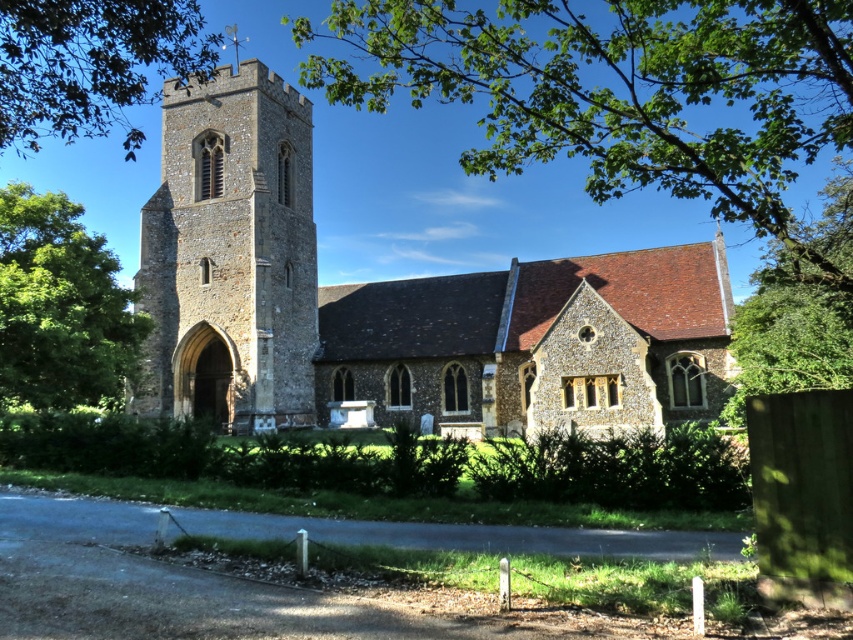
You are standing on the paved road in front of the stone church at center and want to walk towards the green leafy tree at left. Which direction should you face to approach the tree?

You should face towards the left side of the stone church at center to approach the green leafy tree at left, as the tree is positioned to the left of the church.

You are standing on the paved road in front of the church and want to take a photo that includes both the stone tower at center and the green leafy tree at upper left. Which object should you position closer to the edge of the frame to ensure both are fully visible?

Since the stone tower at center occupies less space than the green leafy tree at upper left, you should position the stone tower at center closer to the edge of the frame to ensure both objects are fully visible in the photo.